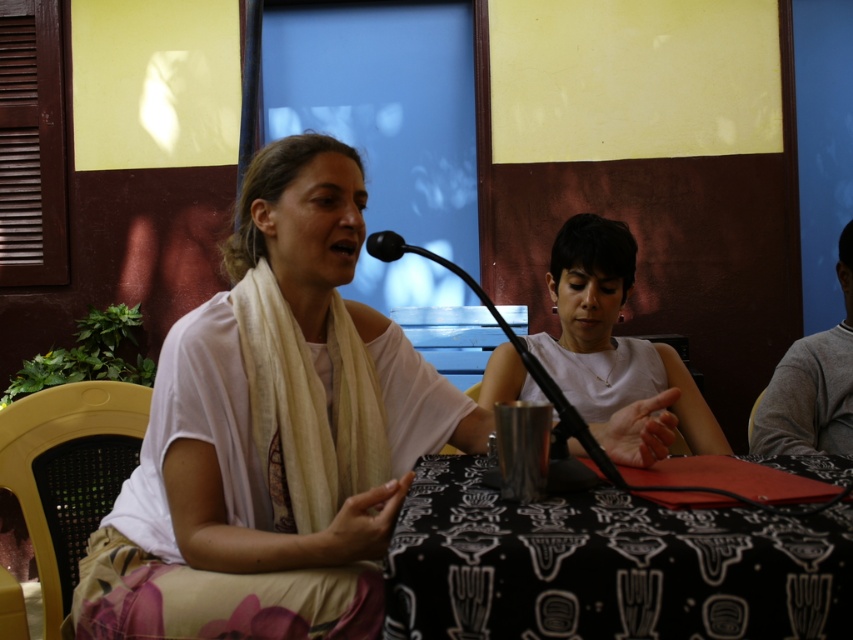
You are organizing a small event and need to decide which item to place on the table. The white cotton scarf at center and the gray sweater at right are both available. Which item has a larger size?

The white cotton scarf at center is bigger than the gray sweater at right, so the white cotton scarf at center is the larger item.

You are organizing a small event and need to decide which item to place on a table that can only accommodate one of the two items. Based on their sizes, which item between the white cotton scarf at center and the white matte shirt at center would you choose to fit on the table?

The white cotton scarf at center is bigger than the white matte shirt at center, so the smaller item, the white matte shirt at center, would fit better on the table.

Consider the image. You are standing in the room where the two people are talking. You need to place a small plant exactly where the white cotton scarf at center is located. What coordinates should you use?

You should place the small plant at coordinates (273,433), which is the exact location of the white cotton scarf at center.